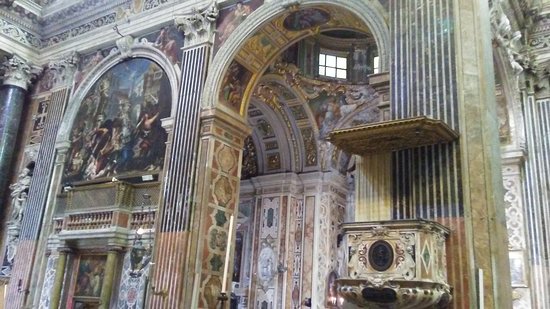
You are a GUI agent. You are given a task and a screenshot of the screen. Output one action in this format:
    pyautogui.click(x=<x>, y=<y>)
    Task: Click on the trim
    The image size is (550, 309).
    Given the screenshot: What is the action you would take?
    pyautogui.click(x=74, y=27)